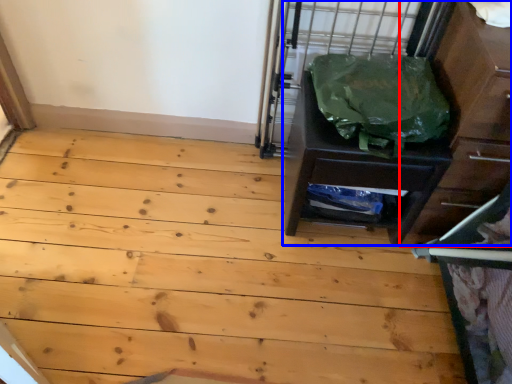
Question: Which of the following is the farthest to the observer, dresser (highlighted by a red box) or chest of drawers (highlighted by a blue box)?

Choices:
 (A) dresser
 (B) chest of drawers

Answer: (B)